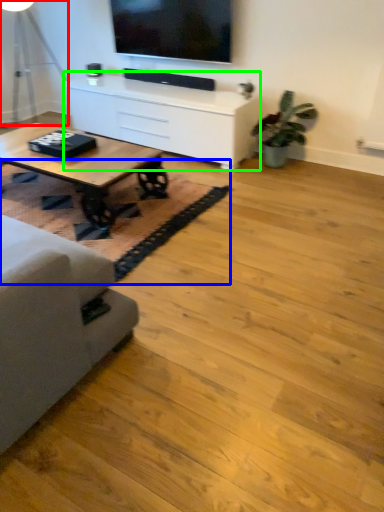
Question: Which object is the closest to the table lamp (highlighted by a red box)? Choose among these: mat (highlighted by a blue box) or table (highlighted by a green box).

Choices:
 (A) mat
 (B) table

Answer: (B)